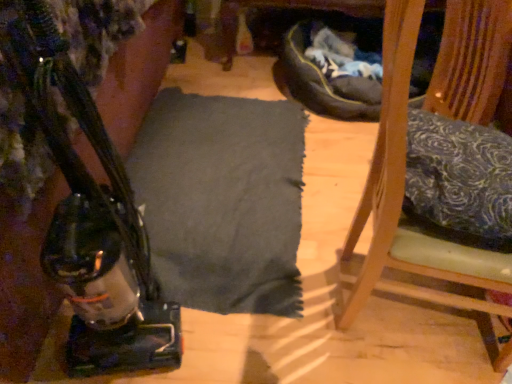
The width and height of the screenshot is (512, 384). I want to click on blue floral fabric pillow at right, so click(460, 174).

Is wooden chair at right completely or partially inside matte black vacuum cleaner at left?

Actually, wooden chair at right is outside matte black vacuum cleaner at left.

In the image, is matte black vacuum cleaner at left positioned in front of or behind wooden chair at right?

matte black vacuum cleaner at left is positioned closer to the viewer than wooden chair at right.

Considering the sizes of objects matte black vacuum cleaner at left and wooden chair at right in the image provided, who is bigger, matte black vacuum cleaner at left or wooden chair at right?

wooden chair at right.

Is matte black vacuum cleaner at left bigger or smaller than blue floral fabric pillow at right?

In the image, matte black vacuum cleaner at left appears to be larger than blue floral fabric pillow at right.

Between matte black vacuum cleaner at left and blue floral fabric pillow at right, which one appears on the left side from the viewer's perspective?

Positioned to the left is matte black vacuum cleaner at left.

Does matte black vacuum cleaner at left come in front of blue floral fabric pillow at right?

That is True.

Is matte black vacuum cleaner at left taller than blue floral fabric pillow at right?

Correct, matte black vacuum cleaner at left is much taller as blue floral fabric pillow at right.

Which is correct: wooden chair at right is inside blue floral fabric pillow at right, or outside of it?

wooden chair at right is spatially situated outside blue floral fabric pillow at right.

In the scene shown: Visually, is wooden chair at right positioned to the left or to the right of blue floral fabric pillow at right?

wooden chair at right is positioned on blue floral fabric pillow at right's right side.

What's the angular difference between wooden chair at right and blue floral fabric pillow at right's facing directions?

There is a 94.8-degree angle between the facing directions of wooden chair at right and blue floral fabric pillow at right.

From a real-world perspective, is wooden chair at right physically below blue floral fabric pillow at right?

Indeed, from a real-world perspective, wooden chair at right is positioned beneath blue floral fabric pillow at right.

What's the angular difference between wooden chair at right and matte black vacuum cleaner at left's facing directions?

wooden chair at right and matte black vacuum cleaner at left are facing 71.1 degrees away from each other.

Is point (384, 208) more distant than point (16, 211)?

Yes.

Image resolution: width=512 pixels, height=384 pixels. Find the location of `job that is above the wooden chair at right (from a real-world perspective)`. job that is above the wooden chair at right (from a real-world perspective) is located at coordinates (24, 239).

Can you confirm if blue floral fabric pillow at right is smaller than wooden chair at right?

Correct, blue floral fabric pillow at right occupies less space than wooden chair at right.

Is the depth of blue floral fabric pillow at right greater than that of wooden chair at right?

That is True.

Is blue floral fabric pillow at right positioned with its back to wooden chair at right?

Correct, blue floral fabric pillow at right is looking away from wooden chair at right.

Based on the photo, considering the relative sizes of blue floral fabric pillow at right and matte black vacuum cleaner at left in the image provided, is blue floral fabric pillow at right wider than matte black vacuum cleaner at left?

Indeed, blue floral fabric pillow at right has a greater width compared to matte black vacuum cleaner at left.

Looking at this image, from a real-world perspective, between blue floral fabric pillow at right and matte black vacuum cleaner at left, who is vertically higher?

blue floral fabric pillow at right.

Is there a large distance between blue floral fabric pillow at right and matte black vacuum cleaner at left?

They are positioned close to each other.

Does blue floral fabric pillow at right have a larger size compared to matte black vacuum cleaner at left?

Actually, blue floral fabric pillow at right might be smaller than matte black vacuum cleaner at left.

Locate an element on the screen. furniture below the matte black vacuum cleaner at left (from a real-world perspective) is located at coordinates tap(401, 203).

Locate an element on the screen. The width and height of the screenshot is (512, 384). job below the blue floral fabric pillow at right (from the image's perspective) is located at coordinates (24, 239).

Which object lies further to the anchor point blue floral fabric pillow at right, matte black vacuum cleaner at left or wooden chair at right?

matte black vacuum cleaner at left is positioned further to the anchor blue floral fabric pillow at right.

Considering their positions, is blue floral fabric pillow at right positioned closer to matte black vacuum cleaner at left than wooden chair at right?

wooden chair at right is positioned closer to the anchor matte black vacuum cleaner at left.

From the image, which object appears to be farther from matte black vacuum cleaner at left, wooden chair at right or blue floral fabric pillow at right?

blue floral fabric pillow at right is positioned further to the anchor matte black vacuum cleaner at left.

From the image, which object appears to be farther from wooden chair at right, matte black vacuum cleaner at left or blue floral fabric pillow at right?

The object further to wooden chair at right is matte black vacuum cleaner at left.

Based on the photo, looking at the image, which one is located closer to wooden chair at right, blue floral fabric pillow at right or matte black vacuum cleaner at left?

Based on the image, blue floral fabric pillow at right appears to be nearer to wooden chair at right.

Estimate the real-world distances between objects in this image. Which object is closer to blue floral fabric pillow at right, wooden chair at right or matte black vacuum cleaner at left?

Among the two, wooden chair at right is located nearer to blue floral fabric pillow at right.

Identify the location of pillow between matte black vacuum cleaner at left and wooden chair at right from left to right. [460, 174].